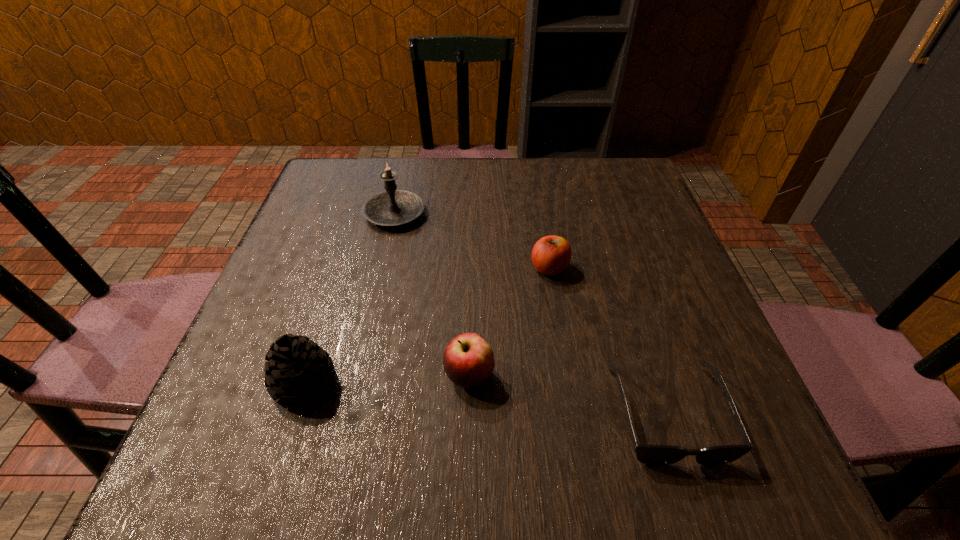
Identify the location of vacant position in the image that satisfies the following two spatial constraints: 1. on the front side of the right apple; 2. at the narrow end of the pinecone. (568, 383).